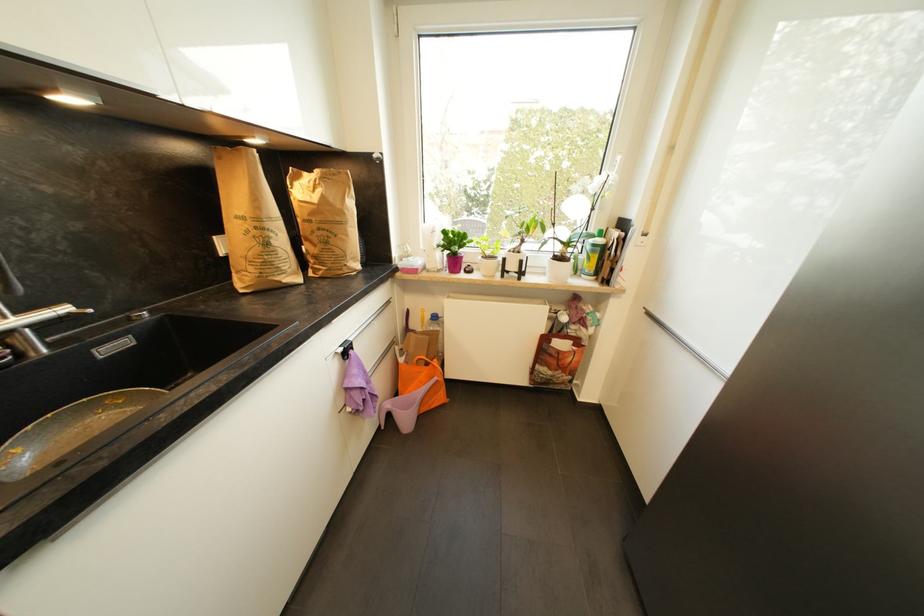
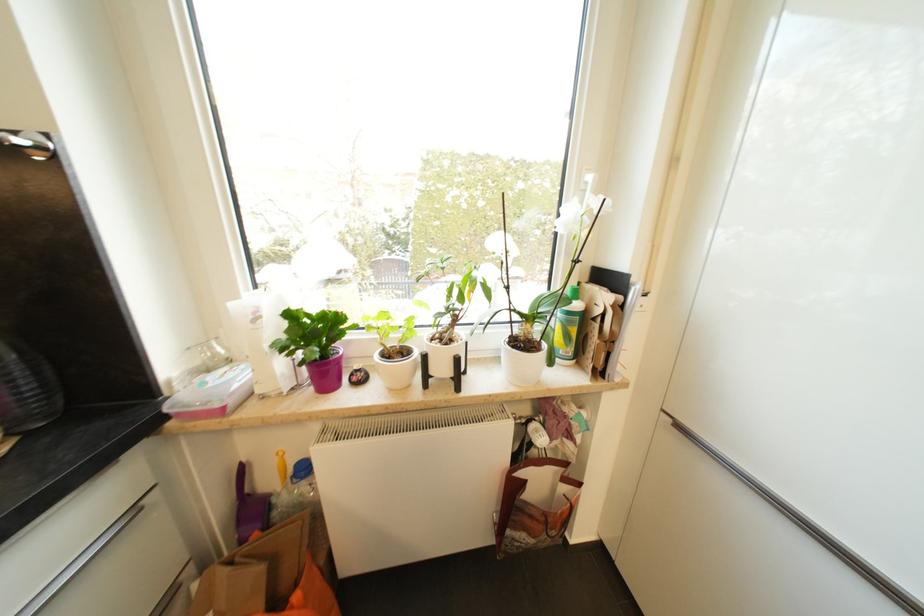
Find the pixel in the second image that matches point 432,318 in the first image.

(295, 471)